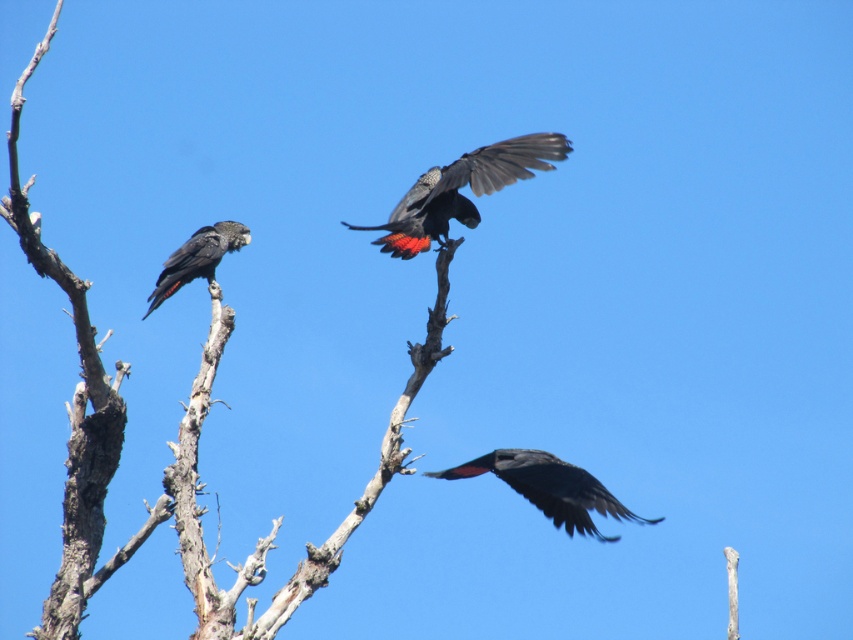
You are standing in a field and see a point marked at coordinates point (492, 157). If you want to take a photo of this point with your camera, will you need to adjust your focus to 30 meters?

The point (492, 157) is 30.09 meters away from the camera. Yes, you need to adjust your focus to approximately 30 meters to capture it clearly.

You are an ornithologist observing the birds in the scene. Which bird has a slimmer body structure between the matte black bird at center and the matte black parrot at left?

The matte black bird at center has a slimmer body structure compared to the matte black parrot at left, as it is thinner than the parrot.

You are an ornithologist observing the scene. You notice two birds, the matte black bird at center and the matte black parrot at left. Which one is located lower in the image?

The matte black bird at center is positioned under the matte black parrot at left, so it is lower in the image.